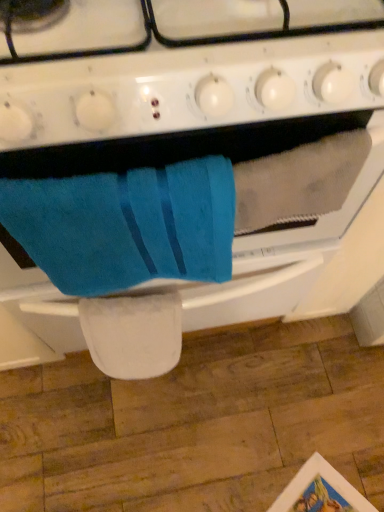
Measure the distance between point (85, 176) and camera.

They are 16.85 inches apart.

Find the location of a particular element. The height and width of the screenshot is (512, 384). white glossy gas stove at upper center is located at coordinates (189, 68).

Does point (99, 241) come behind point (106, 73)?

Yes, point (99, 241) is farther from viewer.

Does blue soft towel at center have a greater height compared to white glossy gas stove at upper center?

Yes, blue soft towel at center is taller than white glossy gas stove at upper center.

Which object is further away from the camera, blue soft towel at center or white glossy gas stove at upper center?

Positioned behind is blue soft towel at center.

I want to click on bath towel that appears on the left of white glossy gas stove at upper center, so click(126, 225).

Is blue terry cloth towel at center positioned with its back to white glossy gas stove at upper center?

No, blue terry cloth towel at center's orientation is not away from white glossy gas stove at upper center.

How distant is blue terry cloth towel at center from white glossy gas stove at upper center?

The distance of blue terry cloth towel at center from white glossy gas stove at upper center is 12.25 centimeters.

From the image's perspective, is blue terry cloth towel at center below white glossy gas stove at upper center?

Yes.

Considering the sizes of objects blue terry cloth towel at center and white glossy gas stove at upper center in the image provided, who is thinner, blue terry cloth towel at center or white glossy gas stove at upper center?

Thinner between the two is white glossy gas stove at upper center.

Is point (272, 72) positioned behind point (296, 94)?

No, it is not.

From a real-world perspective, relative to blue terry cloth towel at center, is white glossy gas stove at upper center vertically above or below?

white glossy gas stove at upper center is situated higher than blue terry cloth towel at center in the real world.

Would you say white glossy gas stove at upper center contains blue terry cloth towel at center?

Actually, blue terry cloth towel at center is outside white glossy gas stove at upper center.

Locate an element on the screen. The image size is (384, 512). oven to the left of white glossy gas stove at upper center is located at coordinates pyautogui.click(x=200, y=154).

Locate an element on the screen. Image resolution: width=384 pixels, height=512 pixels. bath towel located above the blue terry cloth towel at center (from a real-world perspective) is located at coordinates (126, 225).

From a real-world perspective, is blue soft towel at center below blue terry cloth towel at center?

Actually, blue soft towel at center is physically above blue terry cloth towel at center in the real world.

Is blue soft towel at center located outside blue terry cloth towel at center?

No, blue soft towel at center is inside blue terry cloth towel at center's boundary.

Does blue soft towel at center turn towards blue terry cloth towel at center?

Yes, blue soft towel at center faces towards blue terry cloth towel at center.

Does white glossy gas stove at upper center turn towards blue soft towel at center?

No, white glossy gas stove at upper center is not turned towards blue soft towel at center.

Would you say white glossy gas stove at upper center is outside blue soft towel at center?

Yes, white glossy gas stove at upper center is outside of blue soft towel at center.

From a real-world perspective, is white glossy gas stove at upper center positioned above or below blue soft towel at center?

white glossy gas stove at upper center is situated higher than blue soft towel at center in the real world.

I want to click on bath towel below the blue terry cloth towel at center (from the image's perspective), so click(126, 225).

Looking at this image, would you say blue terry cloth towel at center is a long distance from blue soft towel at center?

Actually, blue terry cloth towel at center and blue soft towel at center are a little close together.

Considering the sizes of objects blue terry cloth towel at center and blue soft towel at center in the image provided, who is bigger, blue terry cloth towel at center or blue soft towel at center?

With larger size is blue terry cloth towel at center.

This screenshot has width=384, height=512. What are the coordinates of `gas stove in front of the blue soft towel at center` in the screenshot? It's located at (189, 68).

Where is `oven below the white glossy gas stove at upper center (from the image's perspective)`? oven below the white glossy gas stove at upper center (from the image's perspective) is located at coordinates (200, 154).

From the image, which object appears to be farther from blue terry cloth towel at center, white glossy gas stove at upper center or blue soft towel at center?

white glossy gas stove at upper center.

Looking at the image, which one is located further to blue terry cloth towel at center, blue soft towel at center or white glossy gas stove at upper center?

white glossy gas stove at upper center is further to blue terry cloth towel at center.

Looking at the image, which one is located further to blue soft towel at center, white glossy gas stove at upper center or blue terry cloth towel at center?

white glossy gas stove at upper center lies further to blue soft towel at center than the other object.

From the image, which object appears to be farther from blue soft towel at center, blue terry cloth towel at center or white glossy gas stove at upper center?

white glossy gas stove at upper center lies further to blue soft towel at center than the other object.

From the image, which object appears to be nearer to white glossy gas stove at upper center, blue soft towel at center or blue terry cloth towel at center?

blue terry cloth towel at center.

Which object lies nearer to the anchor point white glossy gas stove at upper center, blue terry cloth towel at center or blue soft towel at center?

blue terry cloth towel at center.

Find the location of a particular element. This screenshot has width=384, height=512. oven between white glossy gas stove at upper center and blue soft towel at center in the vertical direction is located at coordinates (200, 154).